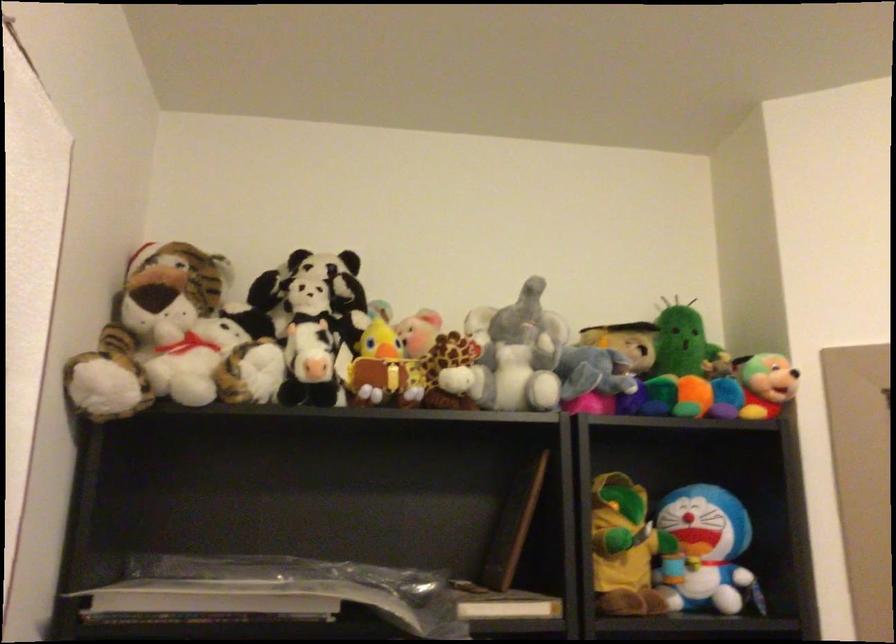
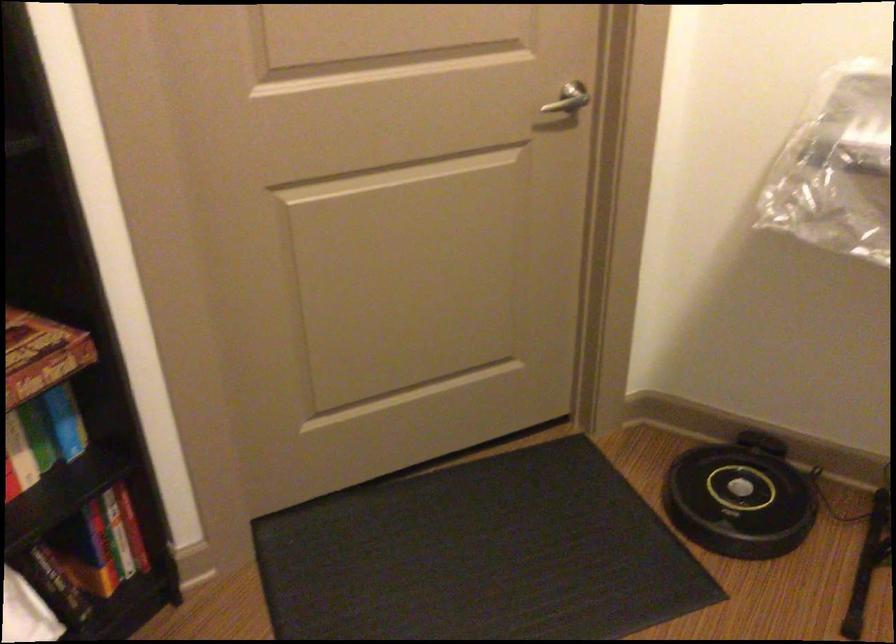
The first image is from the beginning of the video and the second image is from the end. How did the camera likely rotate when shooting the video?

The camera's rotation is toward right-down.